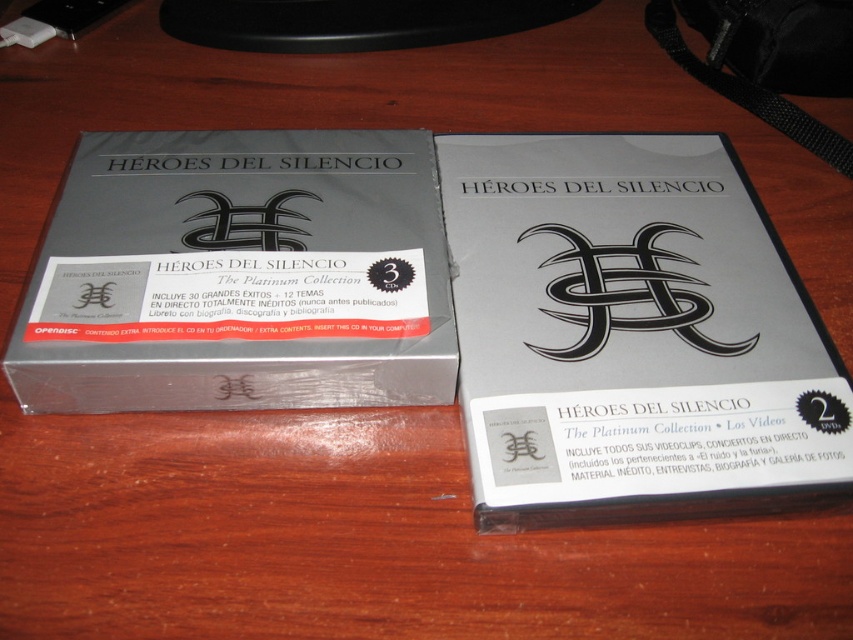
Question: Which point is closer to the camera?

Choices:
 (A) (788, 321)
 (B) (340, 205)

Answer: (A)

Question: Among these objects, which one is nearest to the camera?

Choices:
 (A) matte silver dvd at center
 (B) silver metallic box at center

Answer: (A)

Question: Is matte silver dvd at center smaller than silver metallic box at center?

Choices:
 (A) no
 (B) yes

Answer: (A)

Question: Does matte silver dvd at center have a lesser width compared to silver metallic box at center?

Choices:
 (A) no
 (B) yes

Answer: (B)

Question: Which point appears farthest from the camera in this image?

Choices:
 (A) (744, 432)
 (B) (123, 317)

Answer: (B)

Question: Does matte silver dvd at center have a larger size compared to silver metallic box at center?

Choices:
 (A) no
 (B) yes

Answer: (B)